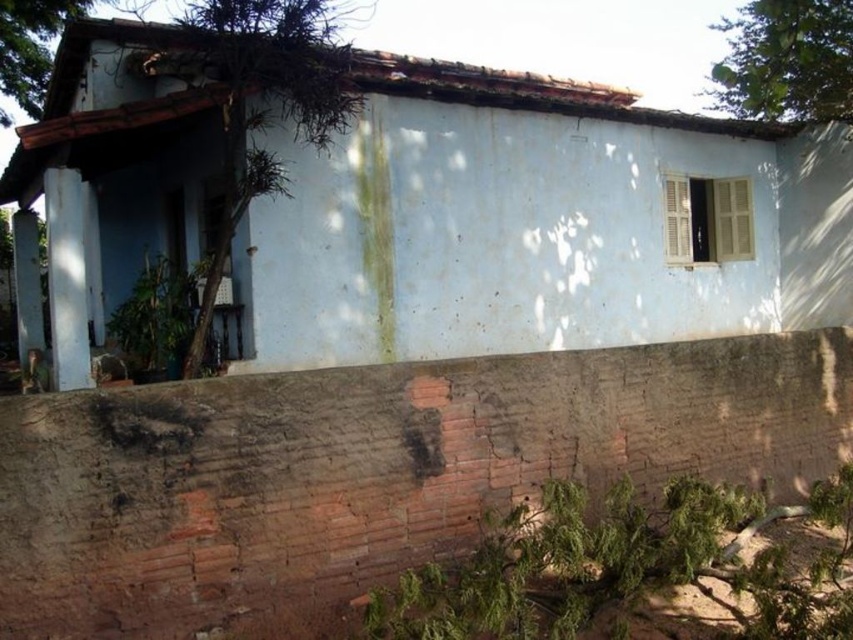
You are standing in front of the house and want to take a photo that includes both the white matte house at center and the green leafy tree at upper right. Which object will appear larger in the photo?

The white matte house at center will appear larger in the photo because it is closer to the viewer than the green leafy tree at upper right.

You are standing at the point marked by point (537, 224). Which direction should you walk to reach the white matte house at center?

The white matte house at center is represented by point (537, 224), so you are already at the location of the white matte house at center.

You are a painter planning to paint both the white matte house at center and the green mossy roof at upper left. You have a limited amount of paint. Based on the scene, which object requires more paint due to its larger surface area?

The white matte house at center requires more paint because its width is larger than the green mossy roof at upper left, indicating a greater surface area.